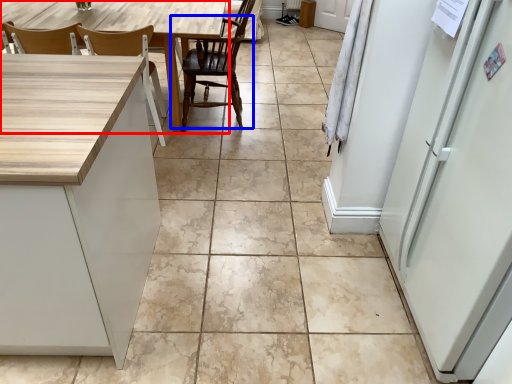
Question: Which point is further to the camera, table (highlighted by a red box) or chair (highlighted by a blue box)?

Choices:
 (A) table
 (B) chair

Answer: (B)